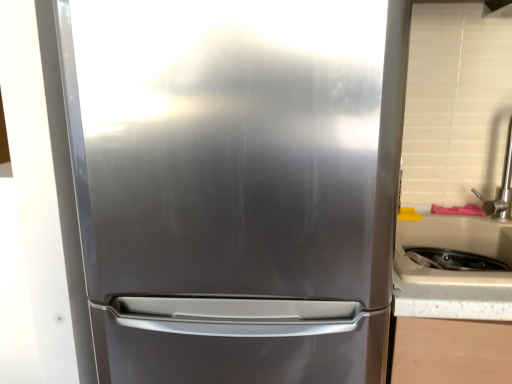
Question: Does white speckled laminate at right have a greater width compared to brushed metal exhaust hood at upper right?

Choices:
 (A) no
 (B) yes

Answer: (B)

Question: Is there a large distance between white speckled laminate at right and brushed metal exhaust hood at upper right?

Choices:
 (A) no
 (B) yes

Answer: (A)

Question: Can you confirm if white speckled laminate at right is taller than brushed metal exhaust hood at upper right?

Choices:
 (A) no
 (B) yes

Answer: (B)

Question: Considering the relative positions of white speckled laminate at right and brushed metal exhaust hood at upper right in the image provided, is white speckled laminate at right to the right of brushed metal exhaust hood at upper right from the viewer's perspective?

Choices:
 (A) no
 (B) yes

Answer: (A)

Question: From the image's perspective, is white speckled laminate at right on brushed metal exhaust hood at upper right?

Choices:
 (A) yes
 (B) no

Answer: (B)

Question: From a real-world perspective, is satin nickel faucet at right above or below brushed metal exhaust hood at upper right?

Choices:
 (A) below
 (B) above

Answer: (A)

Question: Considering the positions of satin nickel faucet at right and brushed metal exhaust hood at upper right in the image, is satin nickel faucet at right bigger or smaller than brushed metal exhaust hood at upper right?

Choices:
 (A) small
 (B) big

Answer: (B)

Question: Considering the relative positions of satin nickel faucet at right and brushed metal exhaust hood at upper right in the image provided, is satin nickel faucet at right to the left or to the right of brushed metal exhaust hood at upper right?

Choices:
 (A) left
 (B) right

Answer: (A)

Question: Considering the positions of satin nickel faucet at right and brushed metal exhaust hood at upper right in the image, is satin nickel faucet at right wider or thinner than brushed metal exhaust hood at upper right?

Choices:
 (A) thin
 (B) wide

Answer: (B)

Question: Is brushed metal exhaust hood at upper right in front of or behind stainless steel refrigerator at center in the image?

Choices:
 (A) behind
 (B) front

Answer: (A)

Question: Is brushed metal exhaust hood at upper right situated inside stainless steel refrigerator at center or outside?

Choices:
 (A) outside
 (B) inside

Answer: (A)

Question: Is point (492, 6) closer or farther from the camera than point (260, 140)?

Choices:
 (A) closer
 (B) farther

Answer: (B)

Question: Is brushed metal exhaust hood at upper right wider or thinner than stainless steel refrigerator at center?

Choices:
 (A) wide
 (B) thin

Answer: (B)

Question: Considering the positions of point (487, 8) and point (500, 205), is point (487, 8) closer or farther from the camera than point (500, 205)?

Choices:
 (A) closer
 (B) farther

Answer: (A)

Question: Considering the positions of brushed metal exhaust hood at upper right and satin nickel faucet at right in the image, is brushed metal exhaust hood at upper right taller or shorter than satin nickel faucet at right?

Choices:
 (A) short
 (B) tall

Answer: (A)